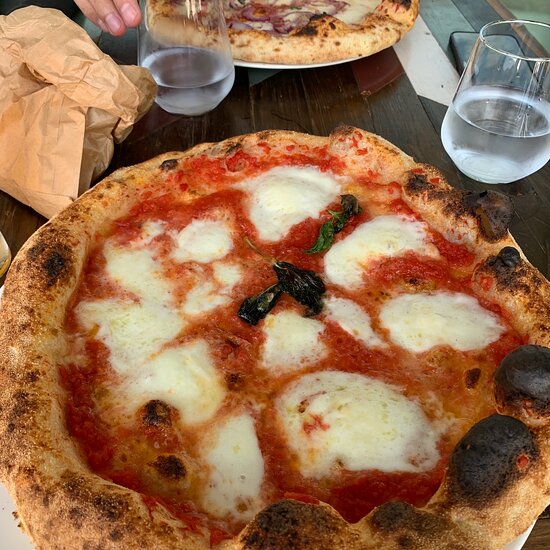
Where is `white board`? white board is located at coordinates (420, 76).